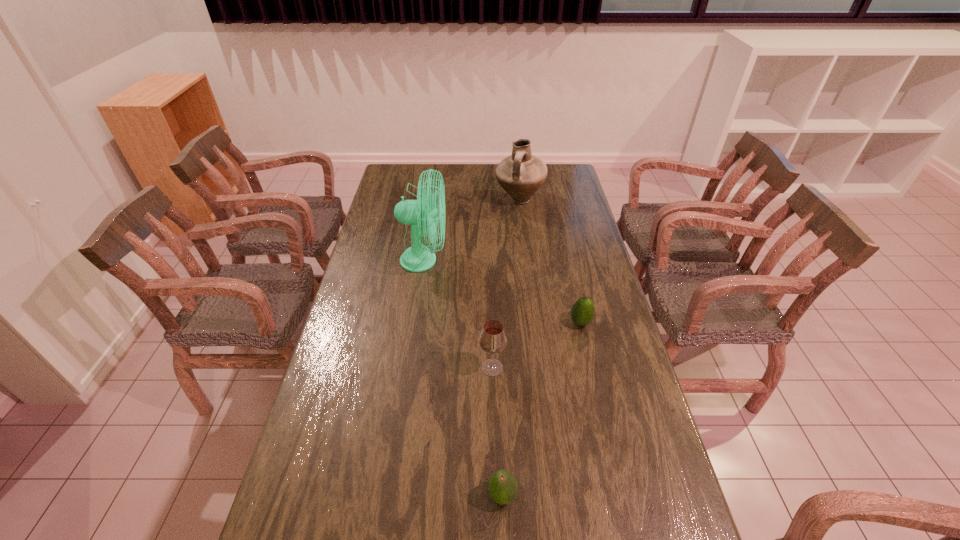
Locate an element on the screen. vacant position located 0.100m in front of the tallest object to blow air is located at coordinates (473, 260).

Where is `free space located on the handle side of the farthest object`? The image size is (960, 540). free space located on the handle side of the farthest object is located at coordinates (527, 260).

Image resolution: width=960 pixels, height=540 pixels. What are the coordinates of `vacant region located on the front of the second nearest object` in the screenshot? It's located at (494, 448).

Where is `free point located on the front of the right avocado`? This screenshot has height=540, width=960. free point located on the front of the right avocado is located at coordinates (603, 422).

Where is `vacant area situated 0.330m on the right of the nearer avocado`? The image size is (960, 540). vacant area situated 0.330m on the right of the nearer avocado is located at coordinates (657, 495).

This screenshot has width=960, height=540. Find the location of `object located in the far edge section of the desktop`. object located in the far edge section of the desktop is located at coordinates (521, 174).

This screenshot has width=960, height=540. What are the coordinates of `object present at the left edge` in the screenshot? It's located at (417, 258).

You are a GUI agent. You are given a task and a screenshot of the screen. Output one action in this format:
    pyautogui.click(x=<x>, y=<y>)
    Task: Click on the object positioned at the right edge
    
    Given the screenshot: What is the action you would take?
    pyautogui.click(x=582, y=312)

Where is `free space at the far edge of the desktop`? This screenshot has height=540, width=960. free space at the far edge of the desktop is located at coordinates point(465,167).

Find the location of a particular element. Image resolution: width=960 pixels, height=540 pixels. vacant space at the left edge of the desktop is located at coordinates (376, 242).